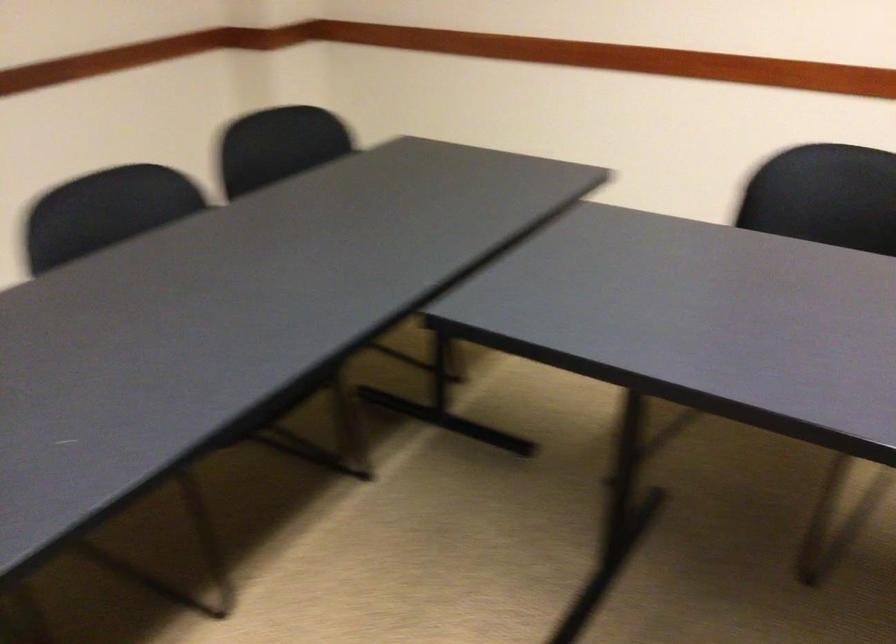
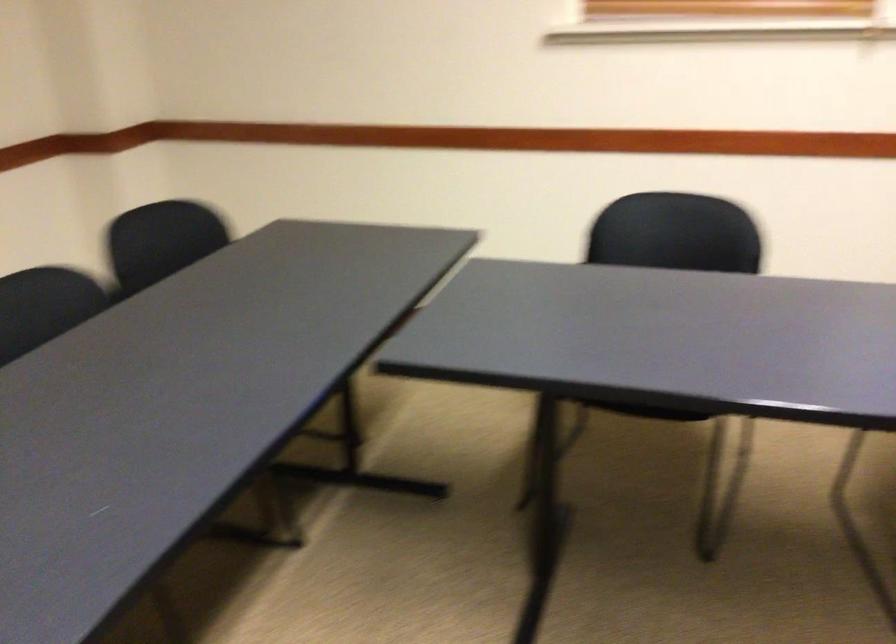
Question: The camera is either moving clockwise (left) or counter-clockwise (right) around the object. The first image is from the beginning of the video and the second image is from the end. Is the camera moving left or right when shooting the video?

Choices:
 (A) Left
 (B) Right

Answer: (A)